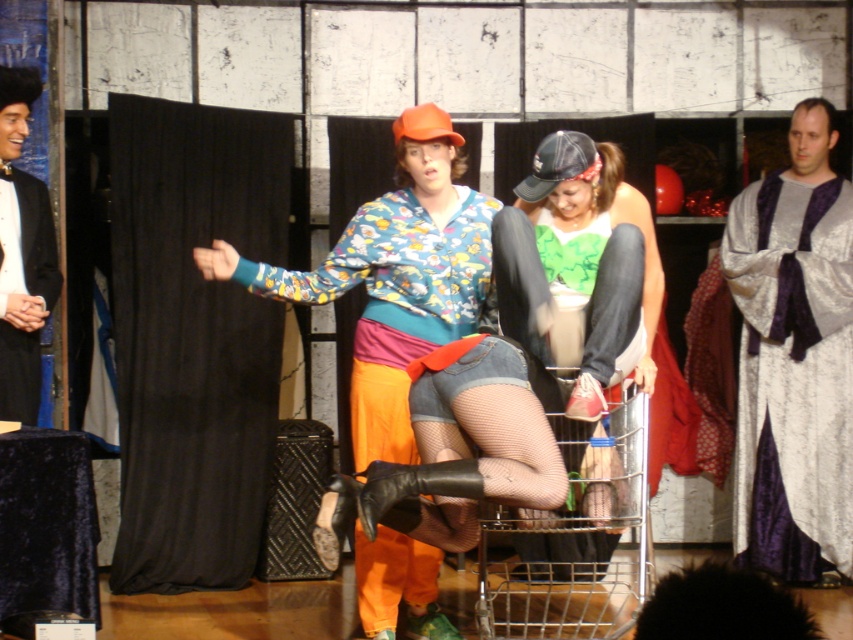
Question: Which point is farther to the camera?

Choices:
 (A) green jersey at center
 (B) silvery metallic robe at right

Answer: (B)

Question: Can you confirm if silvery metallic robe at right is positioned below metallic silver shopping cart at lower center?

Choices:
 (A) no
 (B) yes

Answer: (A)

Question: Which of the following is the closest to the observer?

Choices:
 (A) metallic silver shopping cart at lower center
 (B) silvery metallic robe at right

Answer: (A)

Question: Which point appears closest to the camera in this image?

Choices:
 (A) (788, 516)
 (B) (16, 333)

Answer: (B)

Question: Is silvery metallic robe at right below metallic silver shopping cart at lower center?

Choices:
 (A) no
 (B) yes

Answer: (A)

Question: Is green jersey at center to the right of metallic silver shopping cart at lower center from the viewer's perspective?

Choices:
 (A) no
 (B) yes

Answer: (A)